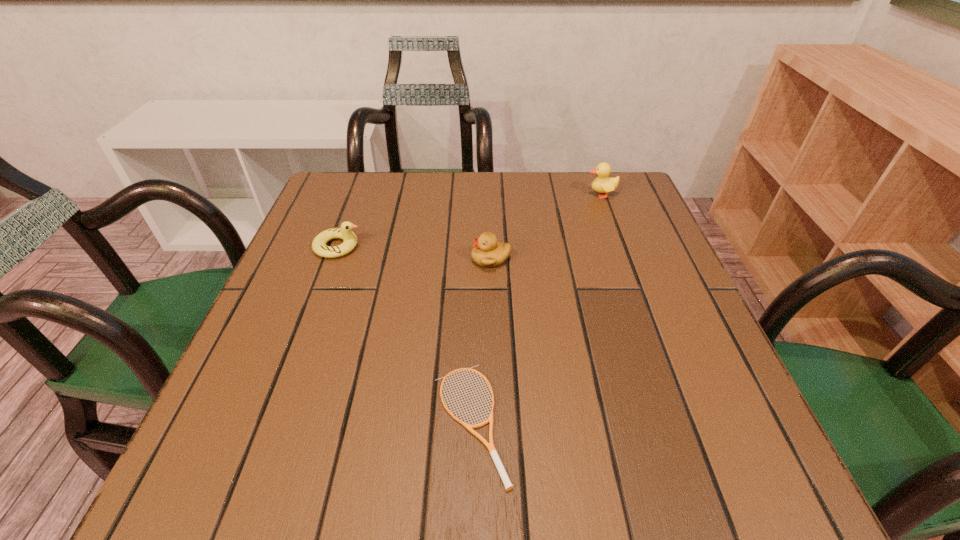
This screenshot has height=540, width=960. I want to click on free space located 0.090m at the beak of the second duckling from right to left, so click(x=429, y=259).

Locate an element on the screen. The width and height of the screenshot is (960, 540). vacant space located 0.320m at the beak of the second duckling from right to left is located at coordinates [323, 259].

This screenshot has height=540, width=960. In order to click on vacant space located 0.350m on the face of the leftmost object in this screenshot , I will do `click(519, 247)`.

Identify the location of free space located 0.070m on the left of the nearest object. point(386,422).

This screenshot has width=960, height=540. What are the coordinates of `object present at the far edge` in the screenshot? It's located at (602, 184).

The width and height of the screenshot is (960, 540). I want to click on object at the near edge, so click(x=490, y=446).

The image size is (960, 540). I want to click on object at the left edge, so click(x=319, y=246).

Where is `object at the right edge`? object at the right edge is located at coordinates (602, 184).

Image resolution: width=960 pixels, height=540 pixels. What are the coordinates of `object located at the far right corner` in the screenshot? It's located at 602,184.

Where is `free space at the far edge of the desktop`? Image resolution: width=960 pixels, height=540 pixels. free space at the far edge of the desktop is located at coordinates (395, 172).